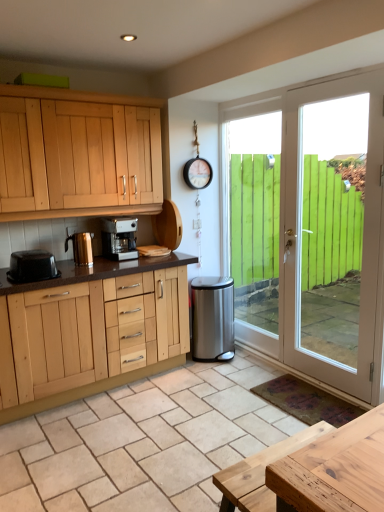
Locate an element on the screen. This screenshot has width=384, height=512. natural wood table at lower right is located at coordinates (260, 473).

You are a GUI agent. You are given a task and a screenshot of the screen. Output one action in this format:
    pyautogui.click(x=<x>, y=<y>)
    Task: Click on the satin silver coffee maker at center, which is the 3th kitchen appliance from left to right
    
    Given the screenshot: What is the action you would take?
    pyautogui.click(x=119, y=238)

Where is `shiny metallic kettle at left, which ranks as the 2th kitchen appliance in right-to-left order`? The image size is (384, 512). shiny metallic kettle at left, which ranks as the 2th kitchen appliance in right-to-left order is located at coordinates (81, 248).

The width and height of the screenshot is (384, 512). Describe the element at coordinates (212, 318) in the screenshot. I see `stainless steel trash can at lower right` at that location.

You are a GUI agent. You are given a task and a screenshot of the screen. Output one action in this format:
    pyautogui.click(x=<x>, y=<y>)
    Task: Click on the white glossy door at right
    This screenshot has height=512, width=384.
    Given the screenshot: What is the action you would take?
    pyautogui.click(x=320, y=234)

Is white glossy door at right spatially inside stainless steel trash can at lower right, or outside of it?

white glossy door at right is spatially situated outside stainless steel trash can at lower right.

Is white glossy door at right positioned in front of stainless steel trash can at lower right?

Yes, it is in front of stainless steel trash can at lower right.

Considering the positions of point (337, 122) and point (232, 321), is point (337, 122) closer or farther from the camera than point (232, 321)?

Point (337, 122).

From the image's perspective, which one is positioned higher, white glossy door at right or stainless steel trash can at lower right?

white glossy door at right.

Is white glossy door at right to the left or to the right of natural wood table at lower right in the image?

From the image, it's evident that white glossy door at right is to the right of natural wood table at lower right.

Who is smaller, white glossy door at right or natural wood table at lower right?

With smaller size is natural wood table at lower right.

Considering the positions of point (290, 174) and point (262, 459), is point (290, 174) closer or farther from the camera than point (262, 459)?

Point (290, 174).

From a real-world perspective, is natural wood table at lower right physically above satin silver coffee maker at center, which is the 3th kitchen appliance from left to right?

No, from a real-world perspective, natural wood table at lower right is not over satin silver coffee maker at center, which is the 3th kitchen appliance from left to right

How many degrees apart are the facing directions of natural wood table at lower right and satin silver coffee maker at center, which is the 3th kitchen appliance from left to right?

The facing directions of natural wood table at lower right and satin silver coffee maker at center, which is the 3th kitchen appliance from left to right, are 179 degrees apart.

From the image's perspective, who appears lower, natural wood table at lower right or satin silver coffee maker at center, which is the 3th kitchen appliance from left to right?

natural wood table at lower right.

Would you consider shiny metallic kettle at left, which appears as the second kitchen appliance when viewed from the left, to be distant from natural wood table at lower right?

Yes.

Is shiny metallic kettle at left, which appears as the second kitchen appliance when viewed from the left, located outside natural wood table at lower right?

Absolutely, shiny metallic kettle at left, which appears as the second kitchen appliance when viewed from the left, is external to natural wood table at lower right.

Looking at this image, from a real-world perspective, between shiny metallic kettle at left, which ranks as the 2th kitchen appliance in right-to-left order, and natural wood table at lower right, who is vertically higher?

From a 3D spatial view, shiny metallic kettle at left, which ranks as the 2th kitchen appliance in right-to-left order, is above.

Is shiny metallic kettle at left, which appears as the second kitchen appliance when viewed from the left, oriented away from natural wood table at lower right?

That's not correct — shiny metallic kettle at left, which appears as the second kitchen appliance when viewed from the left, is not looking away from natural wood table at lower right.

Between natural wood table at lower right and black plastic toaster at left, which is the 3th kitchen appliance from right to left, which one appears on the left side from the viewer's perspective?

From the viewer's perspective, black plastic toaster at left, which is the 3th kitchen appliance from right to left, appears more on the left side.

From a real-world perspective, is natural wood table at lower right above or below black plastic toaster at left, the 1th kitchen appliance positioned from the left?

From a real-world perspective, natural wood table at lower right is physically below black plastic toaster at left, the 1th kitchen appliance positioned from the left.

Is natural wood table at lower right outside of black plastic toaster at left, the 1th kitchen appliance positioned from the left?

Yes, natural wood table at lower right is not within black plastic toaster at left, the 1th kitchen appliance positioned from the left.

Would you say natural wood table at lower right is a long distance from black plastic toaster at left, which is the 3th kitchen appliance from right to left?

That's right, there is a large distance between natural wood table at lower right and black plastic toaster at left, which is the 3th kitchen appliance from right to left.

Between satin silver coffee maker at center, which is the 3th kitchen appliance from left to right, and natural wood table at lower right, which one has smaller width?

Thinner between the two is natural wood table at lower right.

At what (x,y) coordinates should I click in order to perform the action: click on table below the satin silver coffee maker at center, the first kitchen appliance viewed from the right (from the image's perspective). Please return your answer as a coordinate pair (x, y). This screenshot has height=512, width=384. Looking at the image, I should click on (260, 473).

Considering the relative positions of satin silver coffee maker at center, the first kitchen appliance viewed from the right, and natural wood table at lower right in the image provided, is satin silver coffee maker at center, the first kitchen appliance viewed from the right, behind natural wood table at lower right?

Yes, satin silver coffee maker at center, the first kitchen appliance viewed from the right, is further from the camera.

Looking at this image, is satin silver coffee maker at center, which is the 3th kitchen appliance from left to right, positioned beyond the bounds of natural wood table at lower right?

Yes, satin silver coffee maker at center, which is the 3th kitchen appliance from left to right, is outside of natural wood table at lower right.

Which is closer to the camera, (120,243) or (274,295)?

Clearly, point (120,243) is closer to the camera than point (274,295).

Can you confirm if satin silver coffee maker at center, the first kitchen appliance viewed from the right, is taller than white glossy door at right?

Incorrect, the height of satin silver coffee maker at center, the first kitchen appliance viewed from the right, is not larger of that of white glossy door at right.

The height and width of the screenshot is (512, 384). I want to click on the 3rd kitchen appliance behind when counting from the white glossy door at right, so click(119, 238).

Choose the correct answer: Is satin silver coffee maker at center, which is the 3th kitchen appliance from left to right, inside white glossy door at right or outside it?

The correct answer is: outside.

In the image, there is a stainless steel trash can at lower right. Identify the location of door above it (from the image's perspective). (320, 234).

In the image, there is a white glossy door at right. At what (x,y) coordinates should I click in order to perform the action: click on table below it (from a real-world perspective). Please return your answer as a coordinate pair (x, y). The height and width of the screenshot is (512, 384). Looking at the image, I should click on (260, 473).

Looking at the image, which one is located further to shiny metallic kettle at left, which appears as the second kitchen appliance when viewed from the left, stainless steel trash can at lower right or satin silver coffee maker at center, the first kitchen appliance viewed from the right?

stainless steel trash can at lower right is further to shiny metallic kettle at left, which appears as the second kitchen appliance when viewed from the left.

Considering their positions, is stainless steel trash can at lower right positioned further to shiny metallic kettle at left, which ranks as the 2th kitchen appliance in right-to-left order, than black plastic toaster at left, the 1th kitchen appliance positioned from the left?

stainless steel trash can at lower right is further to shiny metallic kettle at left, which ranks as the 2th kitchen appliance in right-to-left order.

In the scene shown: When comparing their distances from stainless steel trash can at lower right, does natural wood table at lower right or shiny metallic kettle at left, which ranks as the 2th kitchen appliance in right-to-left order, seem further?

natural wood table at lower right is further to stainless steel trash can at lower right.

From the image, which object appears to be farther from satin silver coffee maker at center, which is the 3th kitchen appliance from left to right, black plastic toaster at left, which is the 3th kitchen appliance from right to left, or white glossy door at right?

white glossy door at right lies further to satin silver coffee maker at center, which is the 3th kitchen appliance from left to right, than the other object.

Estimate the real-world distances between objects in this image. Which object is further from stainless steel trash can at lower right, shiny metallic kettle at left, which ranks as the 2th kitchen appliance in right-to-left order, or satin silver coffee maker at center, which is the 3th kitchen appliance from left to right?

shiny metallic kettle at left, which ranks as the 2th kitchen appliance in right-to-left order, lies further to stainless steel trash can at lower right than the other object.

When comparing their distances from natural wood table at lower right, does satin silver coffee maker at center, which is the 3th kitchen appliance from left to right, or black plastic toaster at left, the 1th kitchen appliance positioned from the left, seem closer?

black plastic toaster at left, the 1th kitchen appliance positioned from the left.

Which object lies further to the anchor point shiny metallic kettle at left, which ranks as the 2th kitchen appliance in right-to-left order, stainless steel trash can at lower right or white glossy door at right?

white glossy door at right is further to shiny metallic kettle at left, which ranks as the 2th kitchen appliance in right-to-left order.

Estimate the real-world distances between objects in this image. Which object is closer to black plastic toaster at left, the 1th kitchen appliance positioned from the left, natural wood table at lower right or stainless steel trash can at lower right?

Among the two, stainless steel trash can at lower right is located nearer to black plastic toaster at left, the 1th kitchen appliance positioned from the left.

This screenshot has height=512, width=384. What are the coordinates of `appliance between satin silver coffee maker at center, which is the 3th kitchen appliance from left to right, and white glossy door at right` in the screenshot? It's located at (212, 318).

The image size is (384, 512). I want to click on kitchen appliance between black plastic toaster at left, the 1th kitchen appliance positioned from the left, and satin silver coffee maker at center, the first kitchen appliance viewed from the right, in the front-back direction, so click(81, 248).

At what (x,y) coordinates should I click in order to perform the action: click on table between black plastic toaster at left, which is the 3th kitchen appliance from right to left, and white glossy door at right from left to right. Please return your answer as a coordinate pair (x, y). The height and width of the screenshot is (512, 384). Looking at the image, I should click on (260, 473).

Locate an element on the screen. The image size is (384, 512). kitchen appliance between shiny metallic kettle at left, which ranks as the 2th kitchen appliance in right-to-left order, and white glossy door at right is located at coordinates pos(119,238).